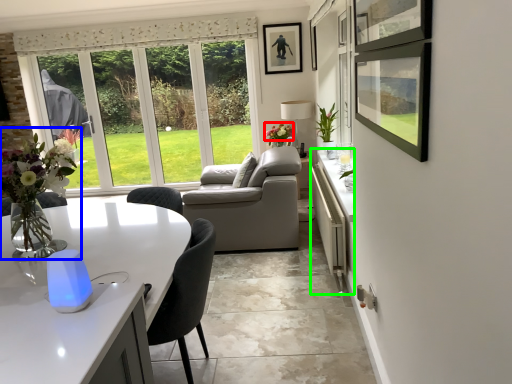
Question: Which is farther away from flower (highlighted by a red box)? floral arrangement (highlighted by a blue box) or counter (highlighted by a green box)?

Choices:
 (A) floral arrangement
 (B) counter

Answer: (A)